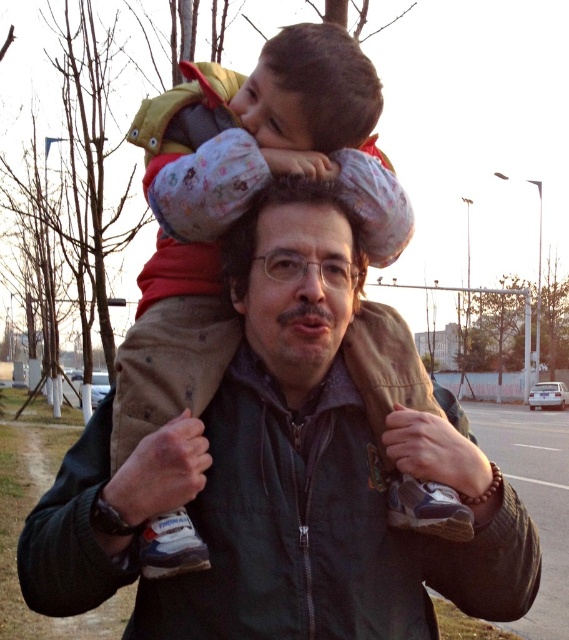
Who is more distant from viewer, (521, 608) or (200, 253)?

Point (200, 253)

Is dark green jacket at center closer to the viewer compared to fluffy fleece jacket at upper center?

Yes, dark green jacket at center is in front of fluffy fleece jacket at upper center.

The image size is (569, 640). What are the coordinates of `dark green jacket at center` in the screenshot? It's located at (282, 476).

Which is in front, point (336, 77) or point (315, 204)?

Positioned in front is point (315, 204).

Which is below, fluffy fleece jacket at upper center or matte brown jacket at center?

fluffy fleece jacket at upper center is lower down.

Locate an element on the screen. The height and width of the screenshot is (640, 569). fluffy fleece jacket at upper center is located at coordinates (253, 154).

Consider the image. Does dark green jacket at center appear on the left side of matte brown jacket at center?

Yes, dark green jacket at center is to the left of matte brown jacket at center.

Between dark green jacket at center and matte brown jacket at center, which one is positioned higher?

matte brown jacket at center

Does point (349, 579) lie in front of point (229, 243)?

That is True.

Where is `dark green jacket at center`? dark green jacket at center is located at coordinates (282, 476).